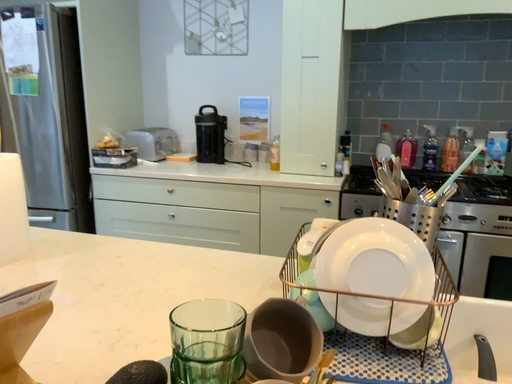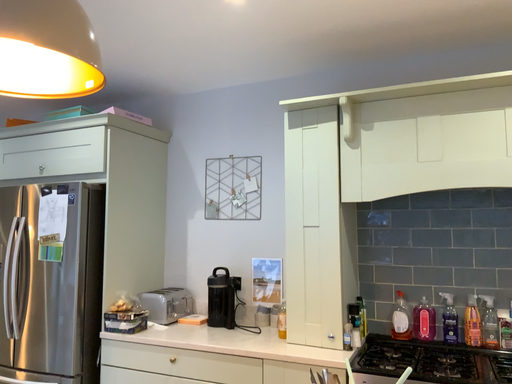
Question: How did the camera likely rotate when shooting the video?

Choices:
 (A) rotated left
 (B) rotated right

Answer: (A)